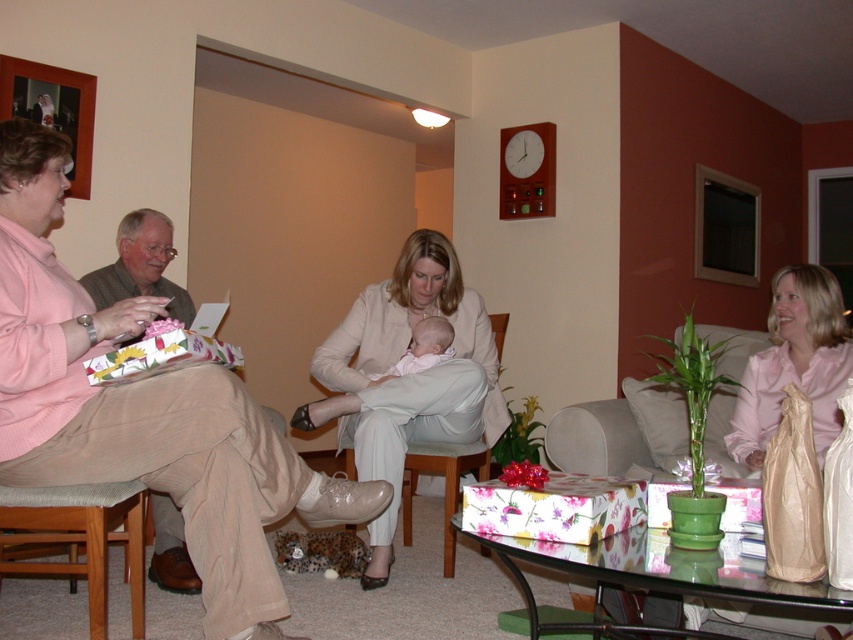
Which is behind, point (497, 394) or point (793, 308)?

Point (497, 394)

Does matte white coat at center appear over pink satin blouse at center?

Incorrect, matte white coat at center is not positioned above pink satin blouse at center.

Identify the location of matte white coat at center. This screenshot has width=853, height=640. (405, 378).

The image size is (853, 640). In order to click on matte white coat at center in this screenshot , I will do `click(405, 378)`.

Consider the image. Is matte pink sweater at left smaller than pink satin blouse at center?

Incorrect, matte pink sweater at left is not smaller in size than pink satin blouse at center.

Between matte pink sweater at left and pink satin blouse at center, which one appears on the left side from the viewer's perspective?

matte pink sweater at left is more to the left.

Locate an element on the screen. The image size is (853, 640). matte pink sweater at left is located at coordinates click(142, 410).

This screenshot has width=853, height=640. Find the location of `matte pink sweater at left`. matte pink sweater at left is located at coordinates (142, 410).

This screenshot has width=853, height=640. Describe the element at coordinates (405, 378) in the screenshot. I see `matte white coat at center` at that location.

Is matte white coat at center taller than soft white baby at center?

Yes.

Is point (471, 332) positioned in front of point (436, 362)?

No, (471, 332) is behind (436, 362).

Identify the location of matte white coat at center. Image resolution: width=853 pixels, height=640 pixels. (405, 378).